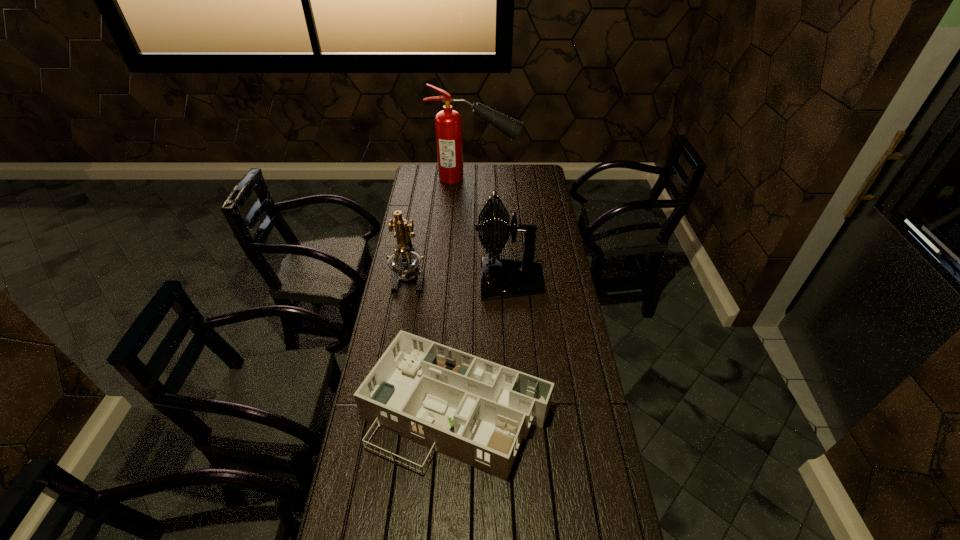
Locate an element on the screen. vacant position in the image that satisfies the following two spatial constraints: 1. at the nozzle of the fire extinguisher; 2. on the front side of the nearest object is located at coordinates (470, 411).

Locate an element on the screen. This screenshot has width=960, height=540. vacant space that satisfies the following two spatial constraints: 1. at the nozzle of the fire extinguisher; 2. at the eyepiece of the second shortest object is located at coordinates tap(472, 279).